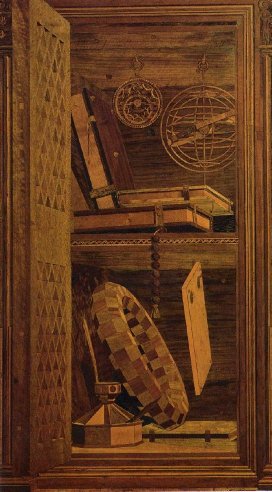
The image size is (272, 492). I want to click on artwork, so click(125, 409).